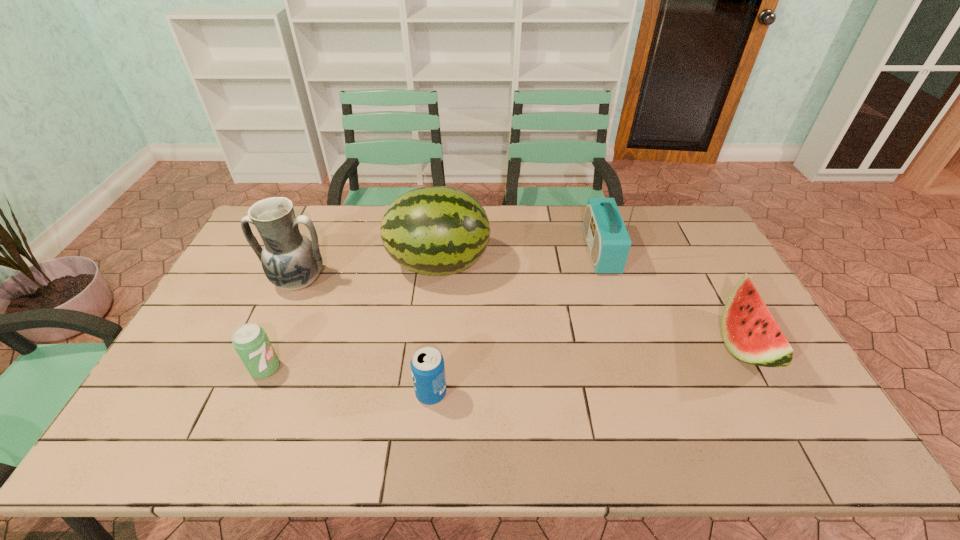
Find the location of a particular element. This screenshot has width=960, height=540. vacant area between the tallest object and the right soda is located at coordinates (516, 322).

Locate an element on the screen. The image size is (960, 540). free space that is in between the pitcher and the left soda is located at coordinates (282, 325).

This screenshot has width=960, height=540. What are the coordinates of `vacant space that is in between the tallest object and the right watermelon` in the screenshot? It's located at (672, 298).

Locate an element on the screen. Image resolution: width=960 pixels, height=540 pixels. blank region between the left soda and the taller watermelon is located at coordinates (352, 316).

Where is `blank region between the pitcher and the right watermelon`? This screenshot has width=960, height=540. blank region between the pitcher and the right watermelon is located at coordinates (520, 313).

You are a GUI agent. You are given a task and a screenshot of the screen. Output one action in this format:
    pyautogui.click(x=<x>, y=<y>)
    Task: Click on the free space between the left soda and the right soda
    The image size is (960, 540).
    Given the screenshot: What is the action you would take?
    pyautogui.click(x=348, y=381)

Where is `free space that is in between the pitcher and the right soda`? This screenshot has height=540, width=960. free space that is in between the pitcher and the right soda is located at coordinates (365, 337).

The image size is (960, 540). Find the location of `vacant point located between the nearer watermelon and the farther watermelon`. vacant point located between the nearer watermelon and the farther watermelon is located at coordinates (590, 305).

Locate an element on the screen. This screenshot has height=540, width=960. empty space that is in between the left watermelon and the pitcher is located at coordinates (369, 273).

Identify which object is located as the fourth nearest to the nearer watermelon. Please provide its 2D coordinates. Your answer should be formatted as a tuple, i.e. [(x, y)], where the tuple contains the x and y coordinates of a point satisfying the conditions above.

[(291, 261)]